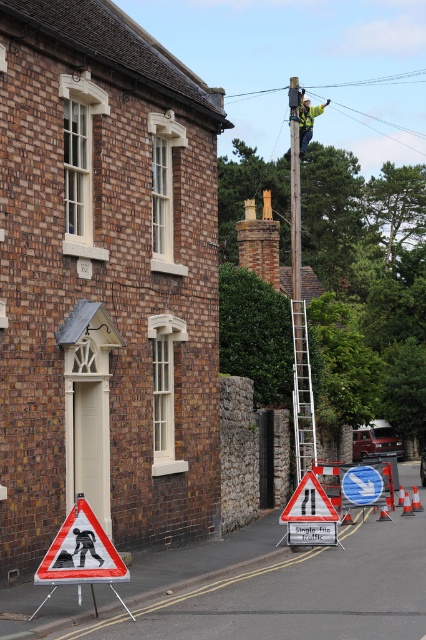
Is point (74, 573) positioned after point (313, 413)?

No, it is in front of (313, 413).

Is point (89, 516) closer to camera compared to point (305, 378)?

Yes, it is in front of point (305, 378).

Between point (88, 544) and point (310, 449), which one is positioned in front?

Point (88, 544) is more forward.

You are a GUI agent. You are given a task and a screenshot of the screen. Output one action in this format:
    pyautogui.click(x=<x>, y=<y>)
    Task: Click on the reflective plastic pedestrian crossing sign at lower left
    This screenshot has width=426, height=640.
    Given the screenshot: What is the action you would take?
    pyautogui.click(x=80, y=552)

Can you confirm if silver metallic ladder at center is wider than white plastic pedestrian crossing sign at lower left?

In fact, silver metallic ladder at center might be narrower than white plastic pedestrian crossing sign at lower left.

This screenshot has height=640, width=426. I want to click on silver metallic ladder at center, so click(302, 392).

Which of these two, silver metallic ladder at center or yellow reflective safety vest at upper center, stands taller?

yellow reflective safety vest at upper center is taller.

Which is more to the right, silver metallic ladder at center or yellow reflective safety vest at upper center?

yellow reflective safety vest at upper center is more to the right.

Where is `silver metallic ladder at center`? Image resolution: width=426 pixels, height=640 pixels. silver metallic ladder at center is located at coordinates (302, 392).